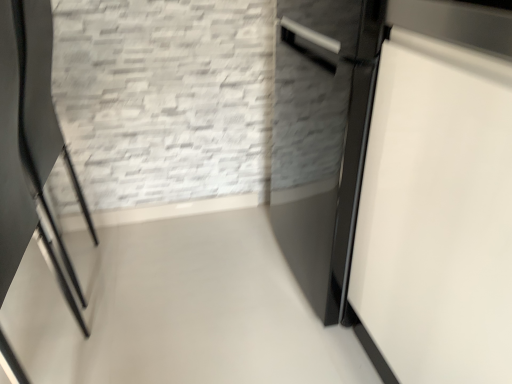
Where is `free area below black glossy chair at left (from a real-world perspective)`? free area below black glossy chair at left (from a real-world perspective) is located at coordinates (54, 277).